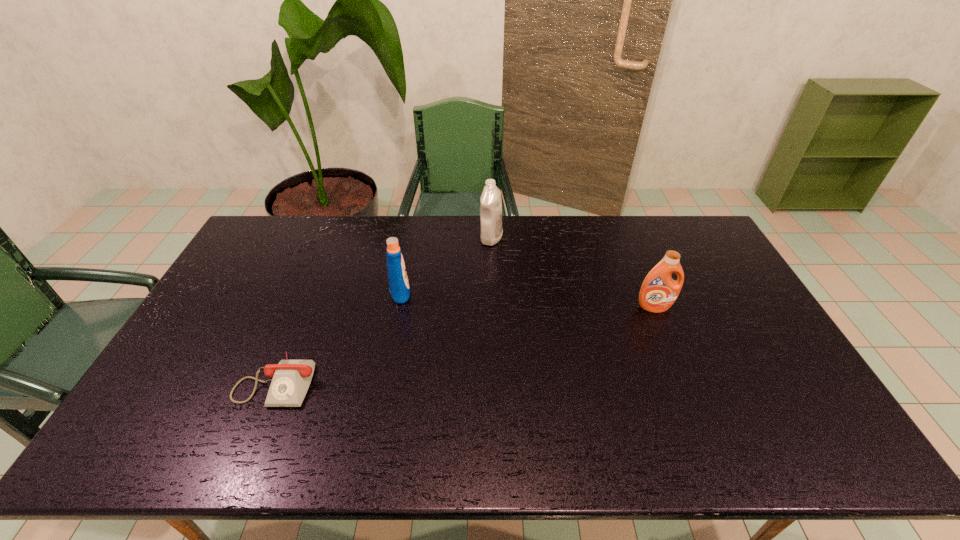
Locate an element on the screen. the farthest object is located at coordinates (491, 230).

I want to click on the farthest detergent, so click(491, 230).

Identify the location of the second object from left to right. Image resolution: width=960 pixels, height=540 pixels. (399, 288).

In order to click on the rightmost detergent in this screenshot , I will do `click(659, 291)`.

Image resolution: width=960 pixels, height=540 pixels. In order to click on the nearest object in this screenshot , I will do `click(291, 378)`.

Where is `the shortest object`? The width and height of the screenshot is (960, 540). the shortest object is located at coordinates (291, 378).

I want to click on free spot located 0.190m on the left of the farthest object, so click(x=428, y=238).

The height and width of the screenshot is (540, 960). What are the coordinates of `free spot located 0.210m on the label of the third object from right to left` in the screenshot? It's located at (476, 291).

Locate an element on the screen. vacant space located on the front-facing side of the rightmost detergent is located at coordinates (668, 341).

The image size is (960, 540). Find the location of `blank space located 0.120m on the dial of the leftmost object`. blank space located 0.120m on the dial of the leftmost object is located at coordinates (247, 455).